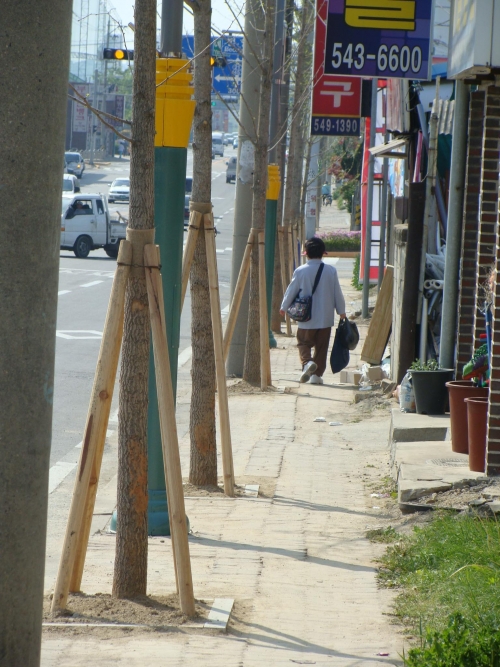
Locate an element on the screen. The height and width of the screenshot is (667, 500). potted plants is located at coordinates (460, 410), (430, 383), (476, 418).